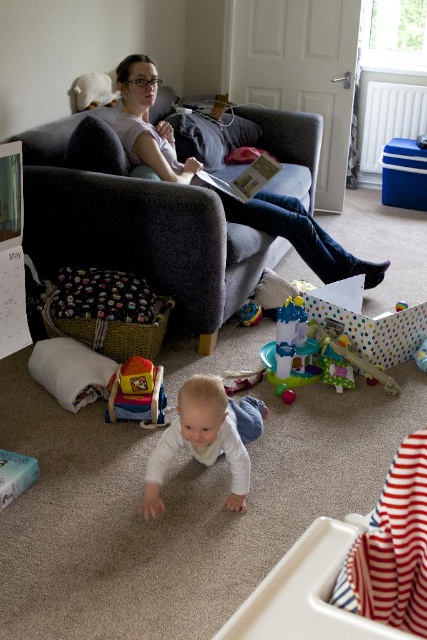
Between dark gray fabric couch at upper center and matte gray couch at upper center, which one has more height?

dark gray fabric couch at upper center is taller.

Does dark gray fabric couch at upper center have a lesser width compared to matte gray couch at upper center?

Yes.

Find the location of a particular element. The width and height of the screenshot is (427, 640). dark gray fabric couch at upper center is located at coordinates (134, 224).

Can you confirm if white soft baby at center is positioned above matte plastic toy at lower center?

Actually, white soft baby at center is below matte plastic toy at lower center.

Consider the image. Does white soft baby at center come in front of matte plastic toy at lower center?

Yes, white soft baby at center is closer to the viewer.

Does point (175, 420) lie behind point (149, 388)?

No, (175, 420) is closer to viewer.

At what (x,y) coordinates should I click in order to perform the action: click on white soft baby at center. Please return your answer as a coordinate pair (x, y). The height and width of the screenshot is (640, 427). Looking at the image, I should click on (205, 438).

Between dark gray fabric couch at upper center and matte plastic toy at lower center, which one appears on the right side from the viewer's perspective?

Positioned to the right is matte plastic toy at lower center.

Does dark gray fabric couch at upper center lie behind matte plastic toy at lower center?

Yes, it is.

Is point (108, 160) farther from viewer compared to point (114, 384)?

Yes, it is.

You are a GUI agent. You are given a task and a screenshot of the screen. Output one action in this format:
    pyautogui.click(x=<x>, y=<y>)
    Task: Click on the dark gray fabric couch at upper center
    
    Given the screenshot: What is the action you would take?
    pyautogui.click(x=134, y=224)